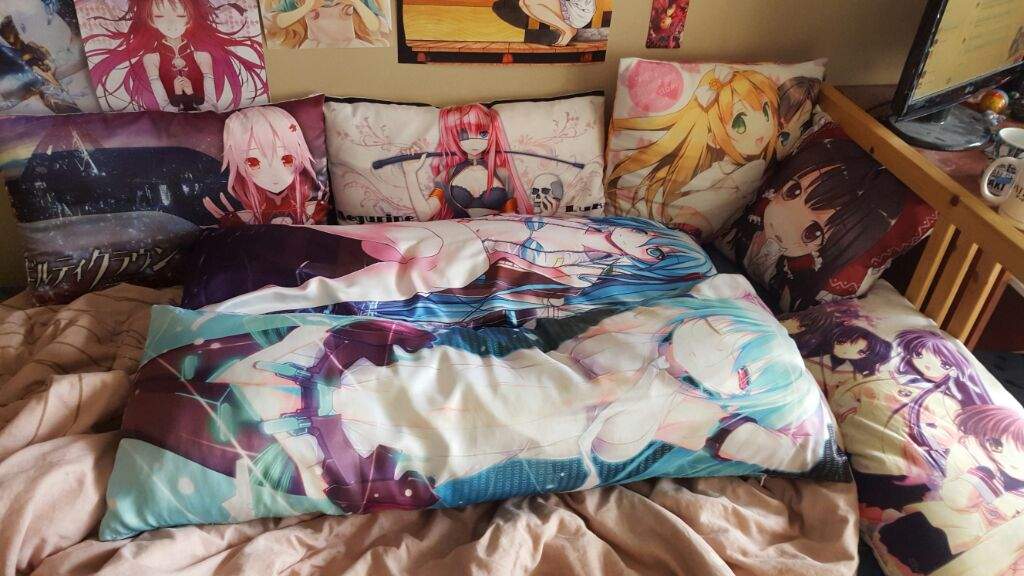
Where is `poster hanging on wall`? This screenshot has height=576, width=1024. poster hanging on wall is located at coordinates (414, 29).